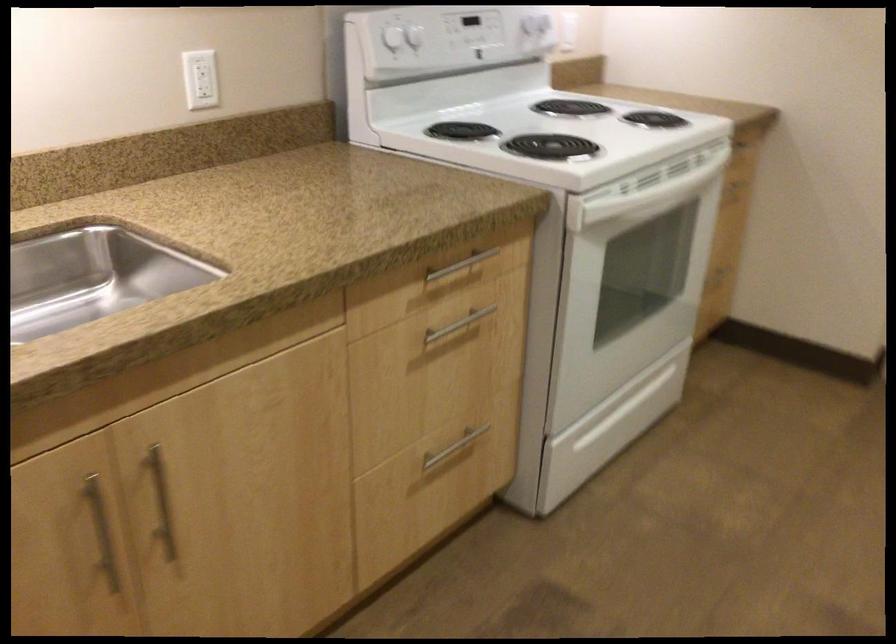
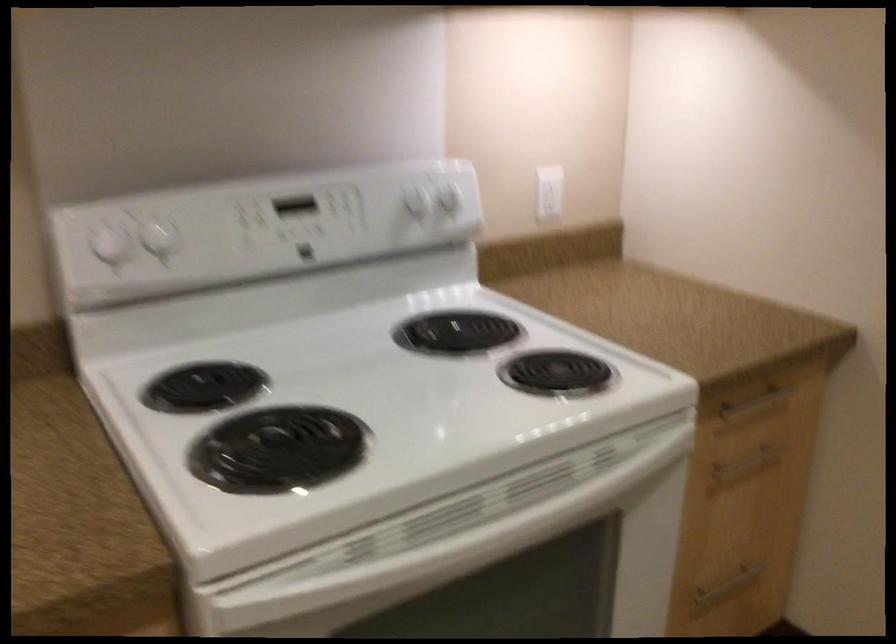
The images are taken continuously from a first-person perspective. In which direction are you moving?

The cameraman moved toward right, forward.